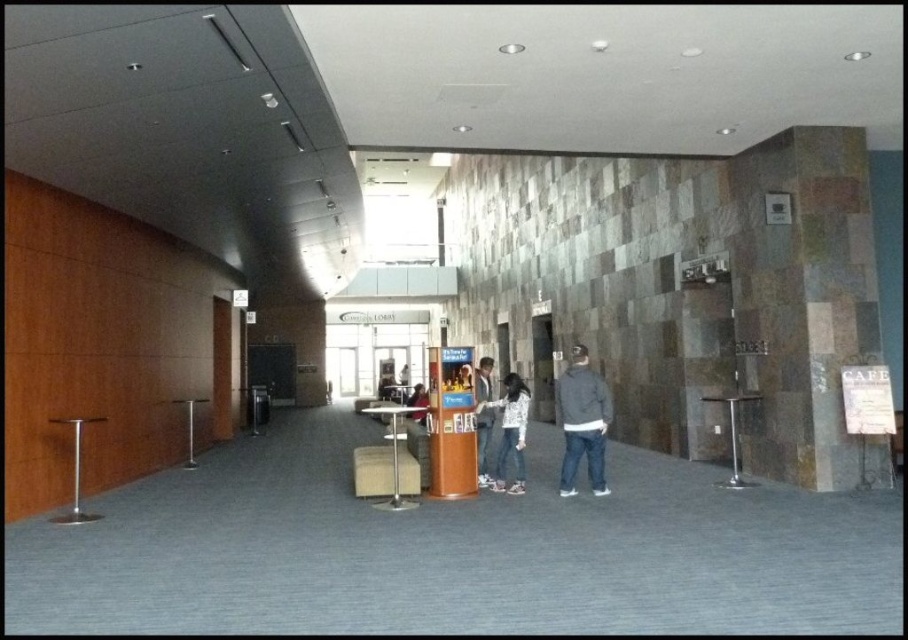
You are standing at the entrance of the modern building and want to walk straight to the brown wood pillar at center. According to the coordinates provided, what are the coordinates of the point you need to walk towards?

The coordinates of the point you need to walk towards are at point (451, 422).

You are standing in the modern building and want to place a small potted plant on the floor between the brown wood pillar at center and the matte gray jacket at center. Is there enough space to place the plant without it being under either object?

The brown wood pillar at center is above the matte gray jacket at center, so the jacket is closer to the floor. There should be enough space between them to place the plant on the floor without it being under either object.

You are standing in the center of the modern building and want to place a small potted plant between the brown wood pillar at center and the matte black jacket at center. Since the space is limited, will the plant fit comfortably between them?

The brown wood pillar at center is smaller than the matte black jacket at center, so there should be enough space to place the small potted plant between them comfortably.